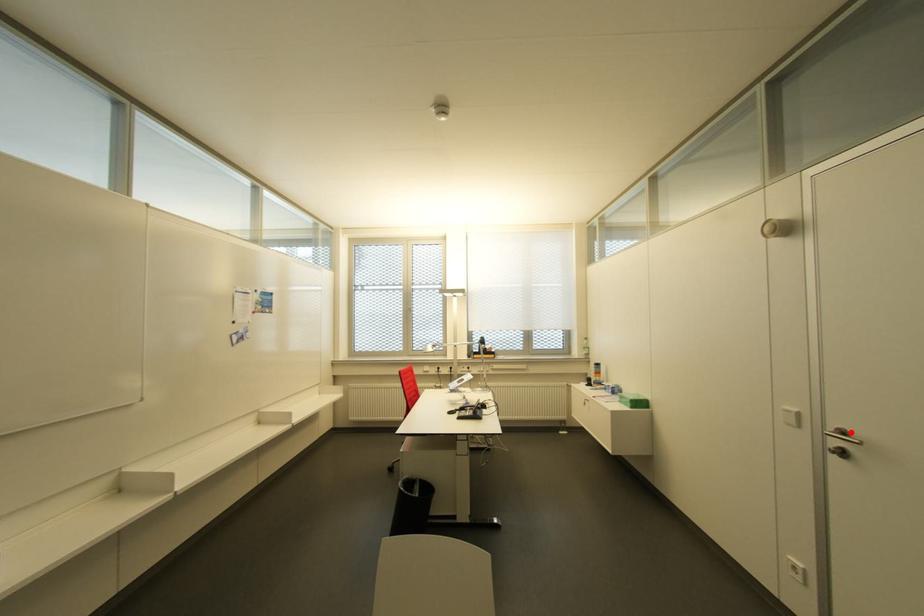
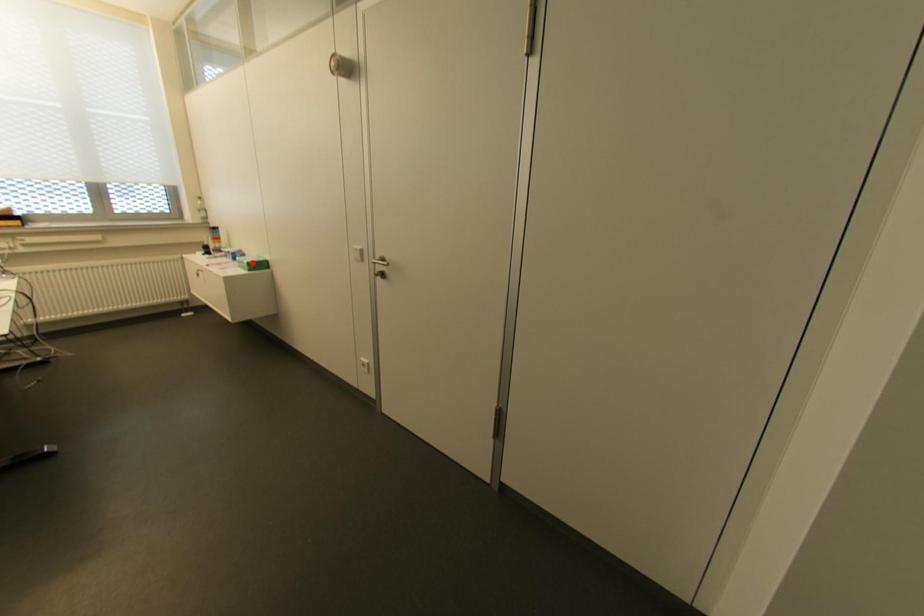
I am providing you with two images of the same scene from different viewpoints. A red point is marked on the first image and another point is marked on the second image. Is the marked point in image1 the same physical position as the marked point in image2?

No